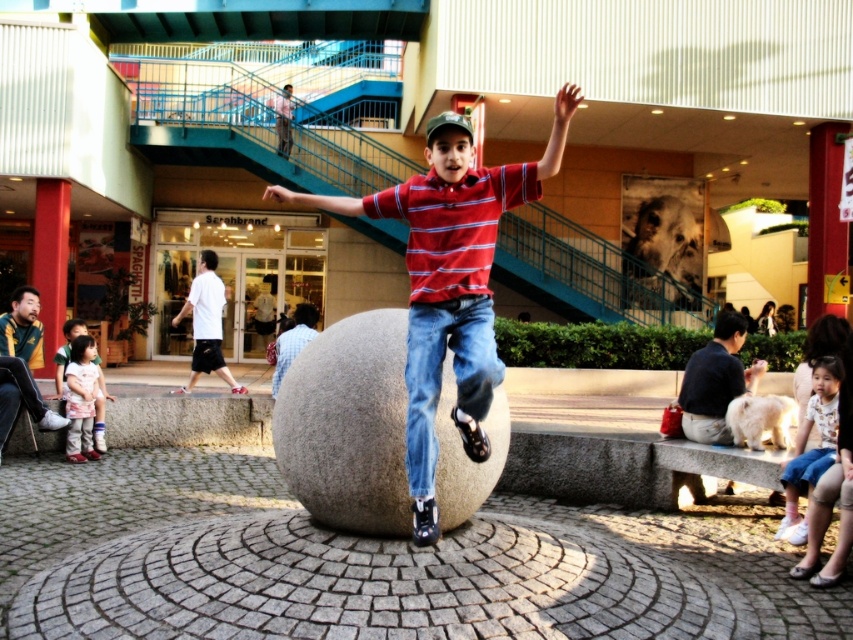
Question: Does blue denim jeans at center have a smaller size compared to white cotton shirt at center?

Choices:
 (A) no
 (B) yes

Answer: (B)

Question: Among these objects, which one is nearest to the camera?

Choices:
 (A) white cotton shirt at center
 (B) matte pink shirt at lower left
 (C) red striped shirt at center
 (D) blue denim jeans at center

Answer: (C)

Question: Does red striped shirt at center appear over white cotton shirt at center?

Choices:
 (A) no
 (B) yes

Answer: (B)

Question: Is blue denim jeans at center wider than matte pink shirt at lower left?

Choices:
 (A) no
 (B) yes

Answer: (B)

Question: Which point is farther to the camera?

Choices:
 (A) blue denim jeans at center
 (B) red striped shirt at center
 (C) light blue denim shorts at lower right

Answer: (C)

Question: Which is farther from the red striped shirt at center?

Choices:
 (A) white cotton shirt at center
 (B) blue denim jeans at center
 (C) matte pink shirt at lower left
 (D) light blue denim shorts at lower right

Answer: (A)